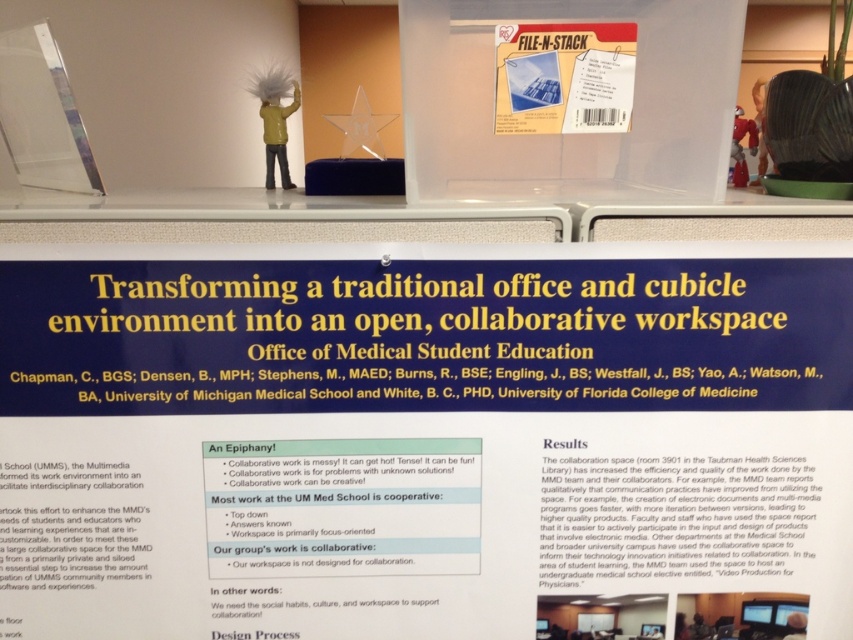
Question: Which point is farther to the camera?

Choices:
 (A) matte plastic file folder at upper center
 (B) white paperboard at center

Answer: (A)

Question: Among these points, which one is farthest from the camera?

Choices:
 (A) (693, 564)
 (B) (637, 116)
 (C) (548, 36)

Answer: (A)

Question: Which point appears closest to the camera in this image?

Choices:
 (A) coord(619,24)
 (B) coord(492,138)

Answer: (A)

Question: Is white paperboard at center wider than transparent plastic container at center?

Choices:
 (A) yes
 (B) no

Answer: (A)

Question: Is the position of transparent plastic container at center less distant than that of matte plastic file folder at upper center?

Choices:
 (A) yes
 (B) no

Answer: (A)

Question: Can you confirm if white paperboard at center is thinner than matte plastic file folder at upper center?

Choices:
 (A) no
 (B) yes

Answer: (A)